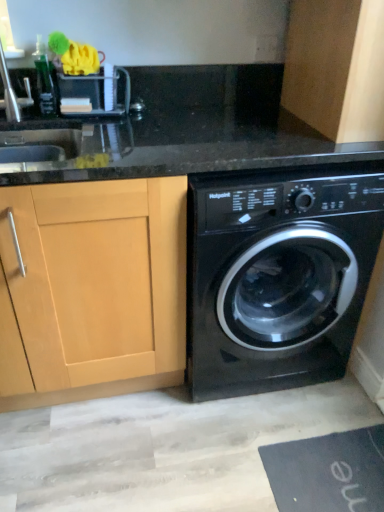
Image resolution: width=384 pixels, height=512 pixels. In order to click on blank space to the left of wooden cabinet at upper right, which is counted as the 2th cabinetry, starting from the left in this screenshot , I will do click(x=264, y=119).